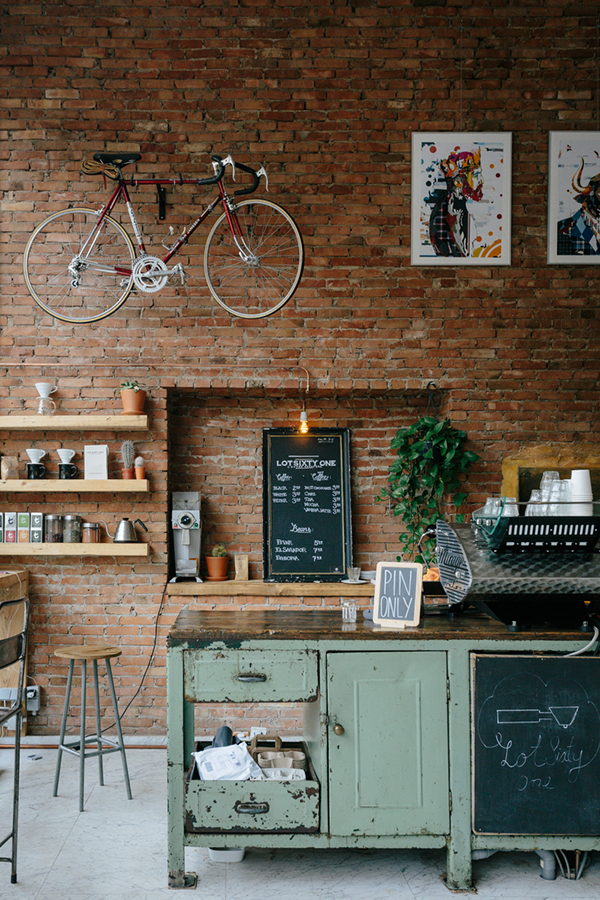
Identify the location of floor. (79, 843).